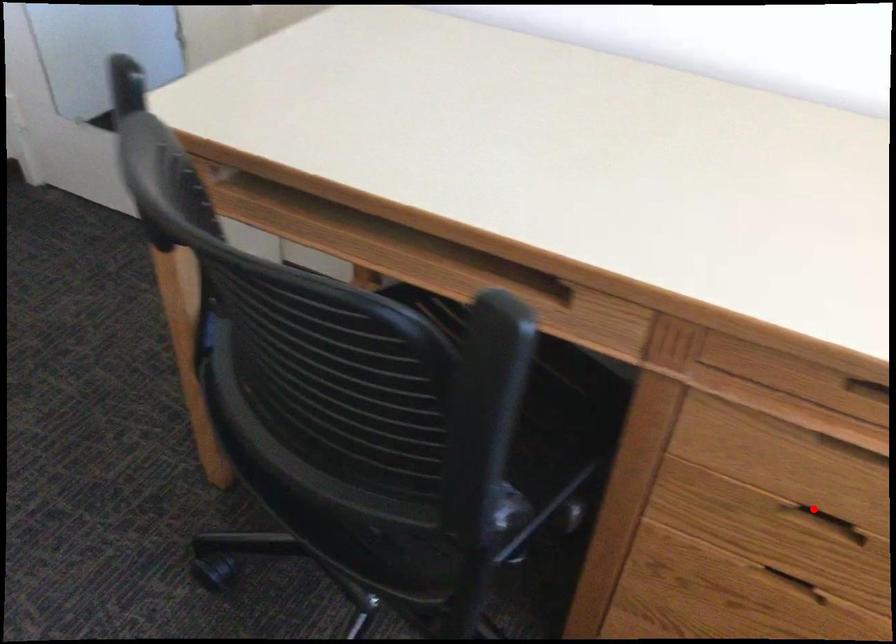
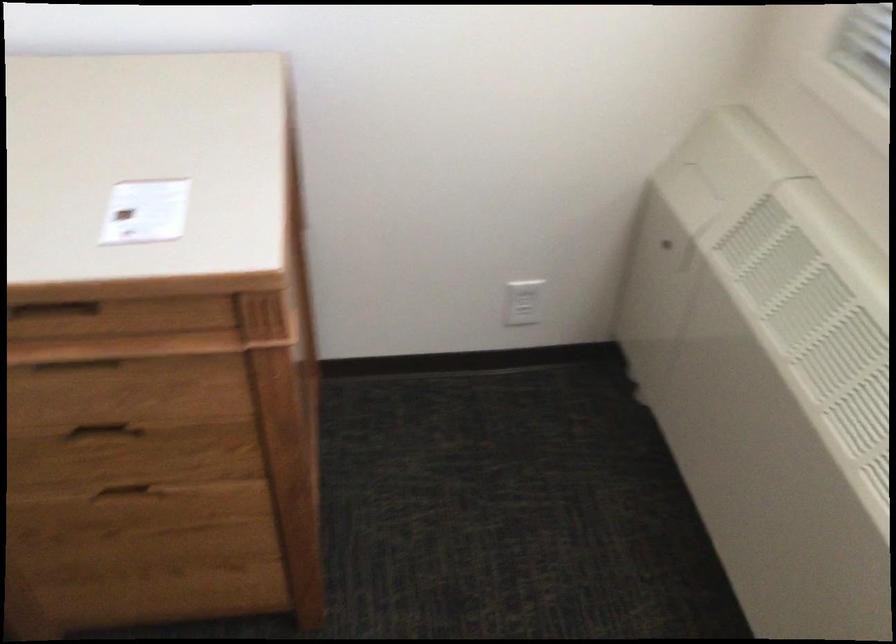
Locate, in the second image, the point that corresponds to the highlighted location in the first image.

(106, 431)